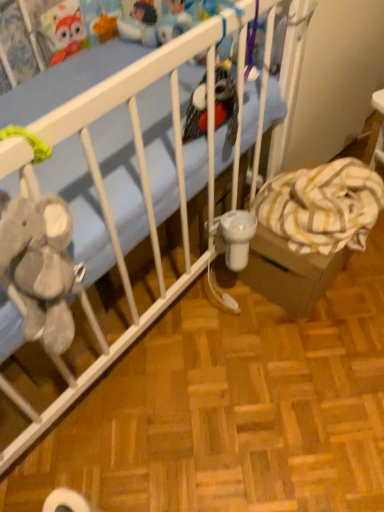
This screenshot has width=384, height=512. In order to click on empty space that is ontop of blue fabric crib at upper left (from a real-world perspective) in this screenshot , I will do `click(240, 376)`.